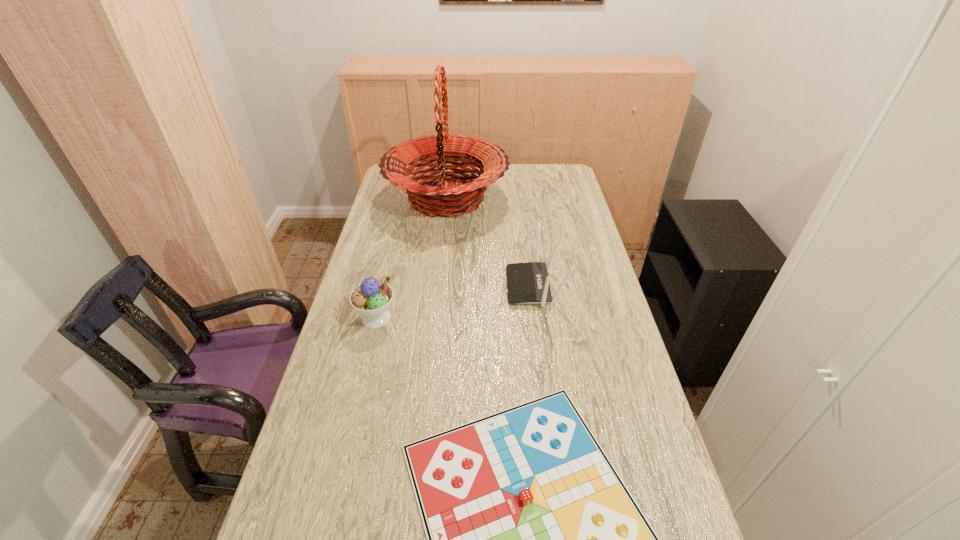
In order to click on vacant area between the router and the tallest object in this screenshot , I will do `click(491, 242)`.

At what (x,y) coordinates should I click in order to perform the action: click on object that stands as the closest to the tallest object. Please return your answer as a coordinate pair (x, y). The width and height of the screenshot is (960, 540). Looking at the image, I should click on click(x=528, y=283).

Where is `the closest object to the shortest object`? This screenshot has height=540, width=960. the closest object to the shortest object is located at coordinates (372, 298).